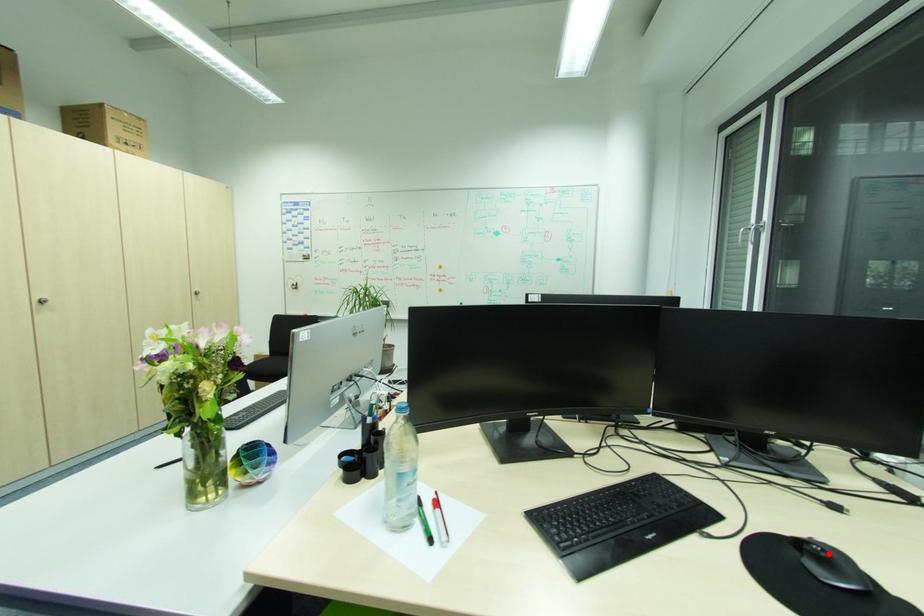
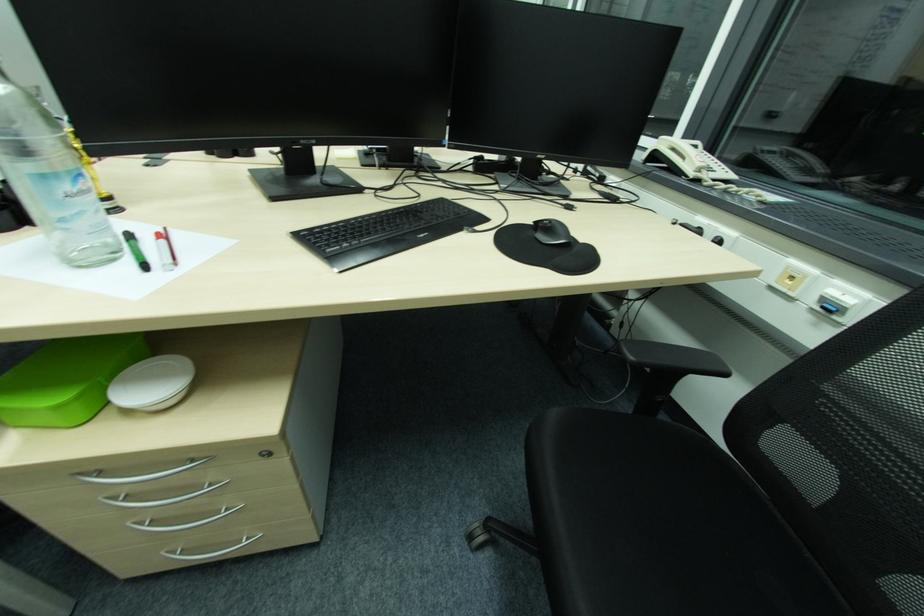
Question: A red point is marked in image1. In image2, is the corresponding 3D point closer to the camera or farther? Reply with the corresponding letter.

Choices:
 (A) The corresponding 3D point is closer.
 (B) The corresponding 3D point is farther.

Answer: (B)